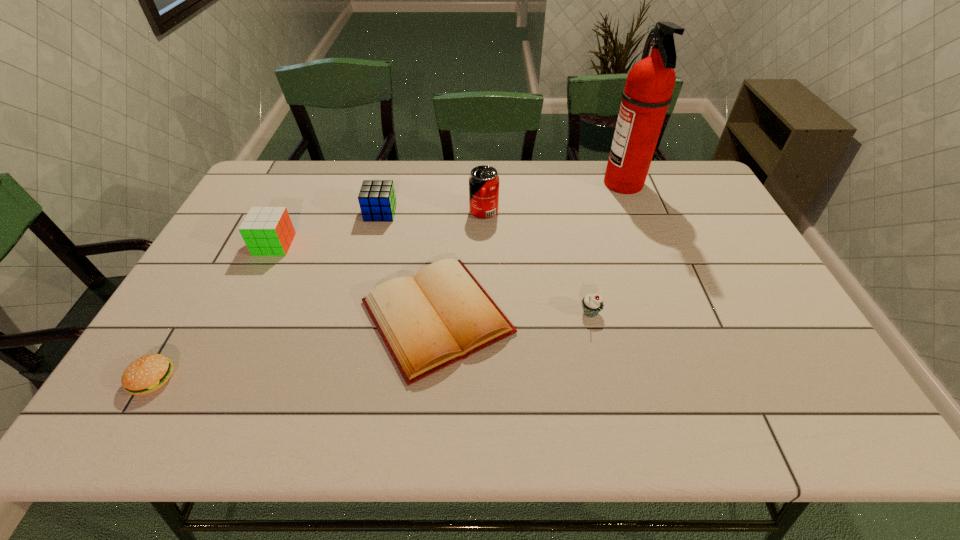
This screenshot has width=960, height=540. In order to click on blank space located 0.140m on the side of the tallest object near the handle in this screenshot , I will do `click(563, 184)`.

Image resolution: width=960 pixels, height=540 pixels. I want to click on free space located 0.190m on the side of the tallest object near the handle, so click(547, 184).

Identify the location of vacant space located 0.220m on the side of the tallest object near the handle. (539, 184).

At what (x,y) coordinates should I click in order to perform the action: click on vacant space located on the right of the soda can. Please return your answer as a coordinate pair (x, y). Looking at the image, I should click on (555, 212).

Find the location of a particular element. The width and height of the screenshot is (960, 540). free location located 0.150m on the right of the left cube is located at coordinates (342, 245).

At what (x,y) coordinates should I click in order to perform the action: click on vacant position located 0.180m on the left of the right cube. Please return your answer as a coordinate pair (x, y). Image resolution: width=960 pixels, height=540 pixels. Looking at the image, I should click on (309, 213).

Find the location of `free point located 0.230m on the left of the second object from right to left`. free point located 0.230m on the left of the second object from right to left is located at coordinates (489, 313).

Identify the location of free space located on the back of the patty. (176, 339).

Image resolution: width=960 pixels, height=540 pixels. In order to click on blank space located 0.310m on the right of the Bible in this screenshot , I will do `click(638, 317)`.

At what (x,y) coordinates should I click in order to perform the action: click on object that is at the far edge. Please return your answer as a coordinate pair (x, y). This screenshot has height=540, width=960. Looking at the image, I should click on (x=648, y=91).